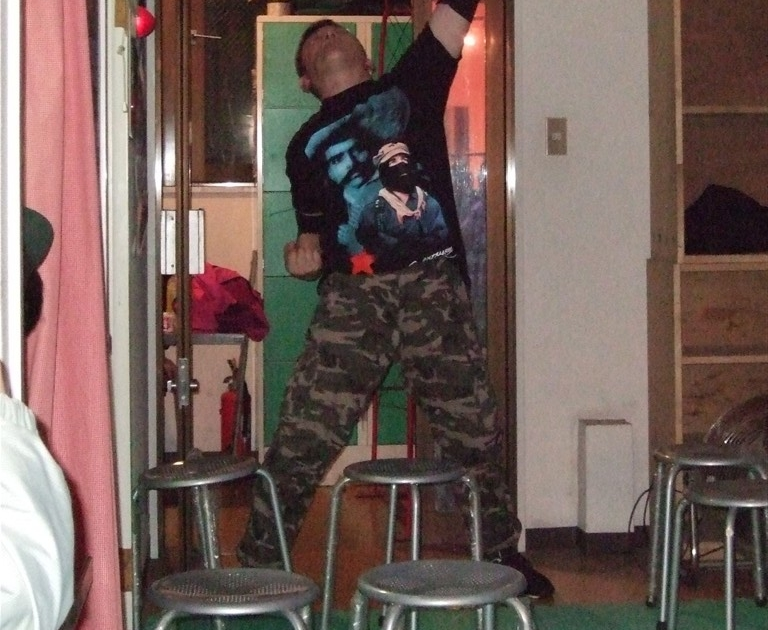
You are a GUI agent. You are given a task and a screenshot of the screen. Output one action in this format:
    pyautogui.click(x=<x>, y=<y>)
    Task: Click on the bookshelf
    
    Given the screenshot: What is the action you would take?
    pyautogui.click(x=722, y=345), pyautogui.click(x=707, y=98)